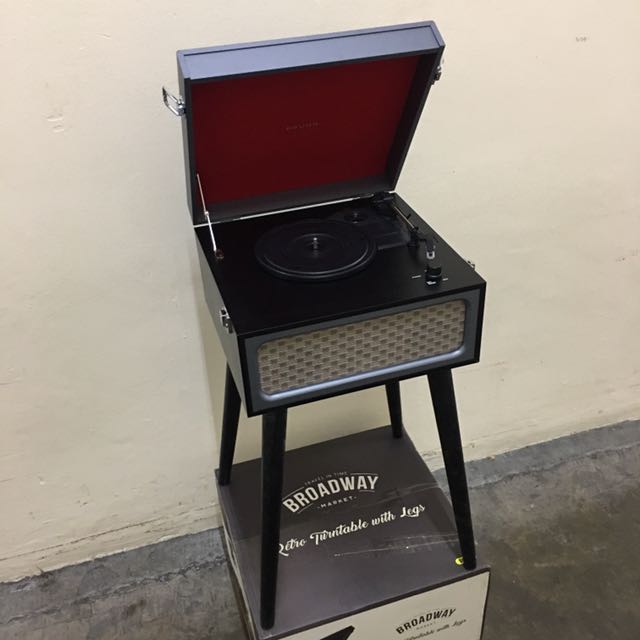
Where is `red felt`? red felt is located at coordinates (324, 109).